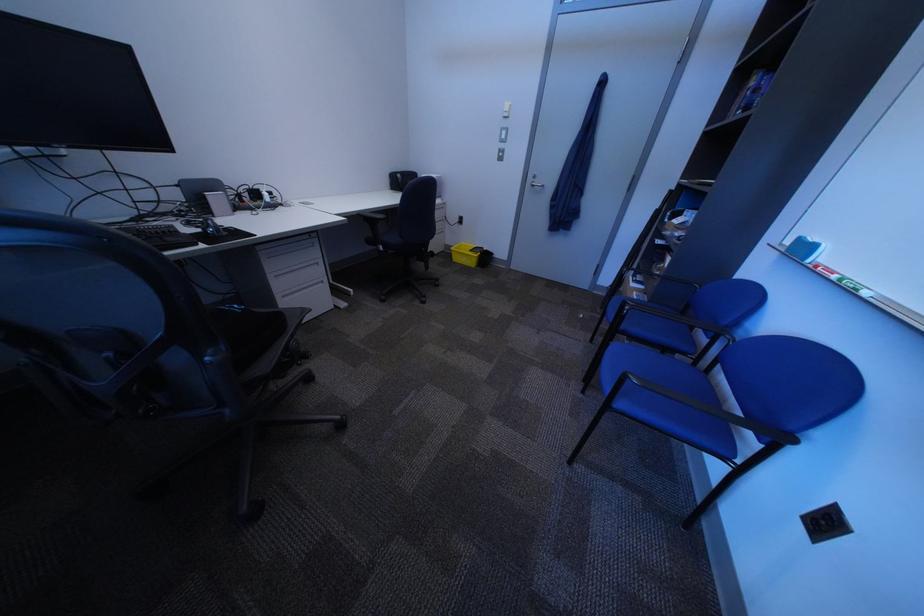
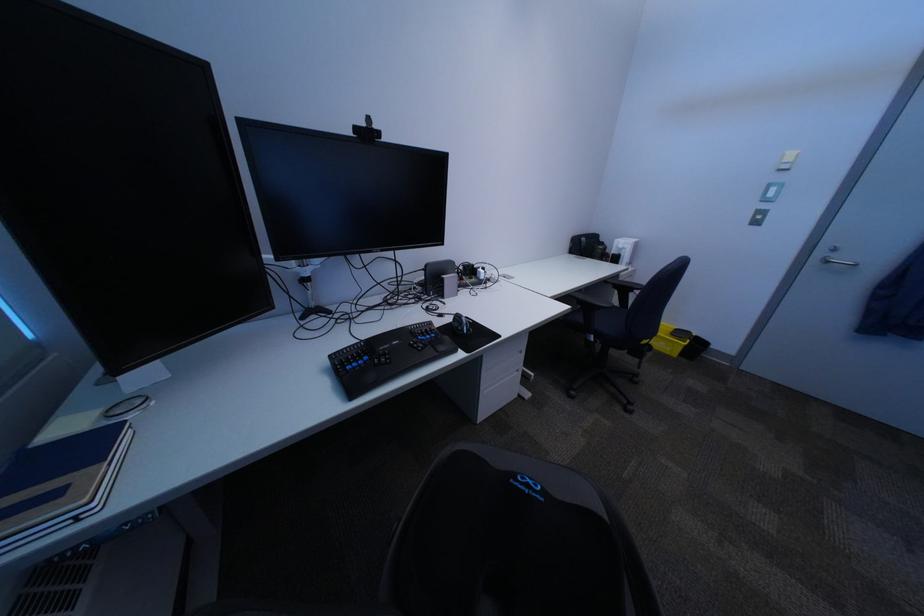
In the second image, find the point that corresponds to point (172, 233) in the first image.

(436, 333)